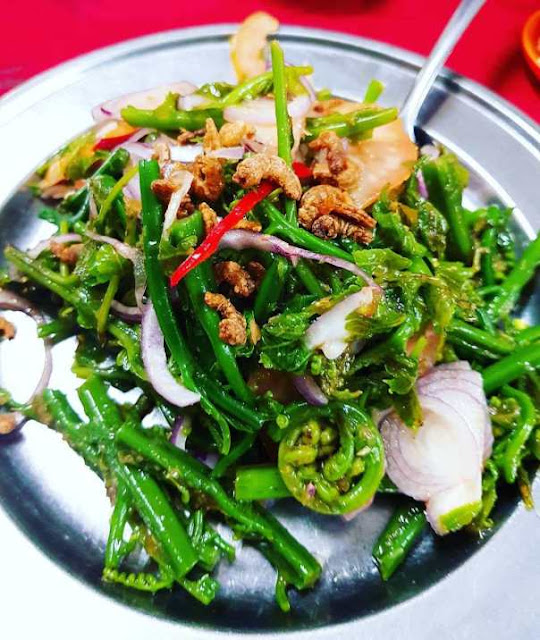
You are a GUI agent. You are given a task and a screenshot of the screen. Output one action in this format:
    pyautogui.click(x=<x>, y=<y>)
    Task: Click on the rim of bowl
    The width and height of the screenshot is (540, 640).
    Given the screenshot: What is the action you would take?
    [x=497, y=594]